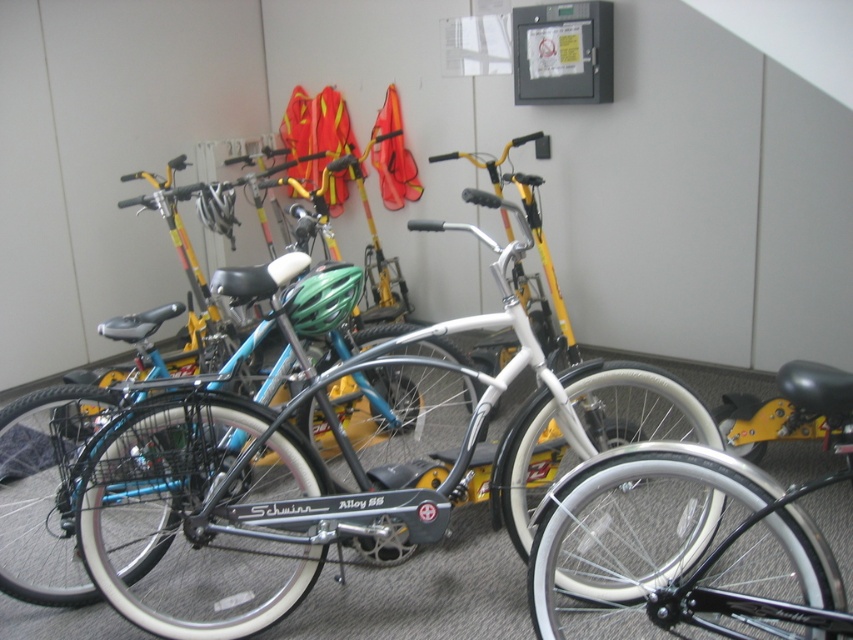
You are trying to decide which bicycle to choose for a short ride. Both the shiny silver bicycle at center and the white rubber bicycle at center are available. Which one would be more suitable if you want a larger frame?

The shiny silver bicycle at center is bigger than the white rubber bicycle at center, so it would be more suitable for a larger frame.

You are a delivery person who needs to choose a bicycle to ride. You are standing in front of the shiny silver bicycle at center and the white rubber bicycle at center. Which bicycle is taller?

The shiny silver bicycle at center is much taller than the white rubber bicycle at center.